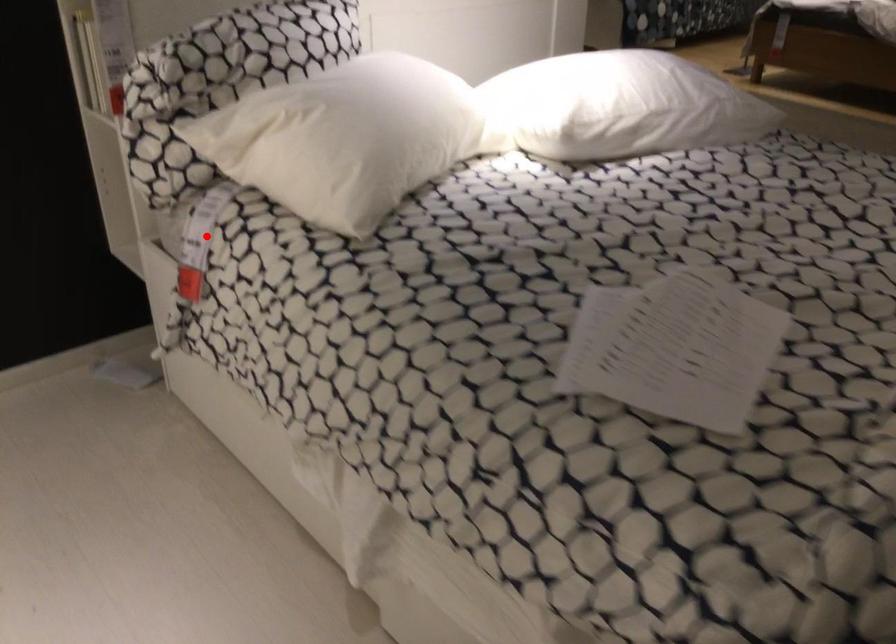
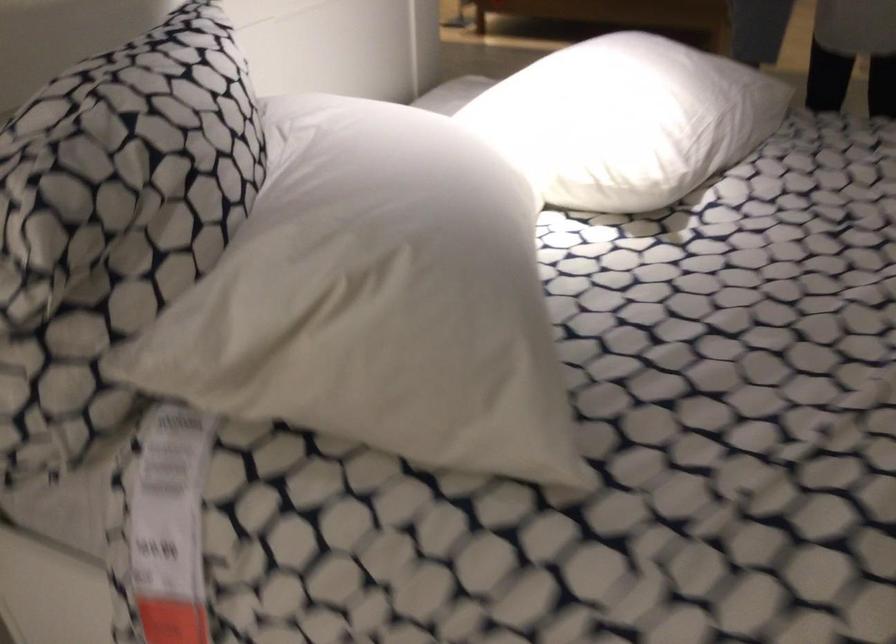
Find the pixel in the second image that matches the highlighted location in the first image.

(169, 526)